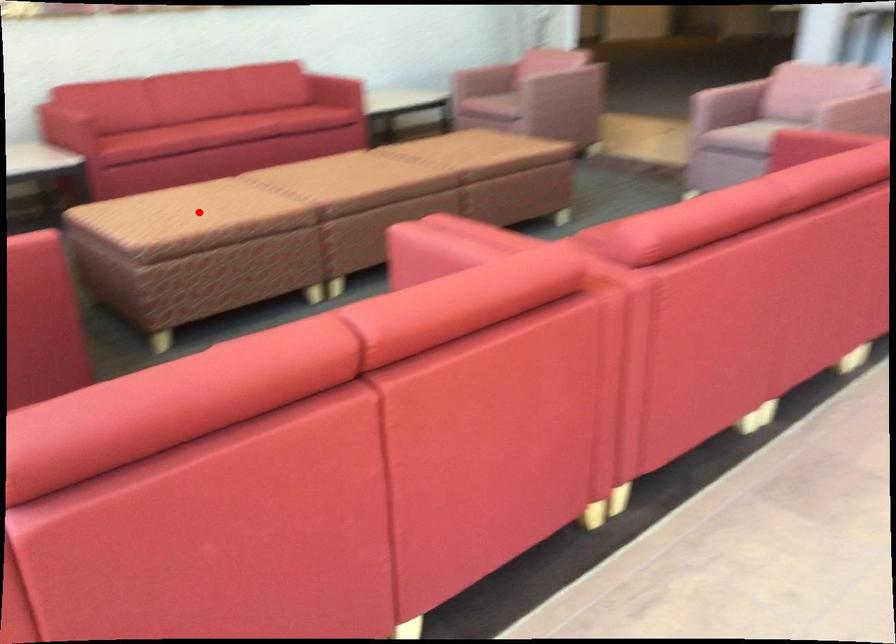
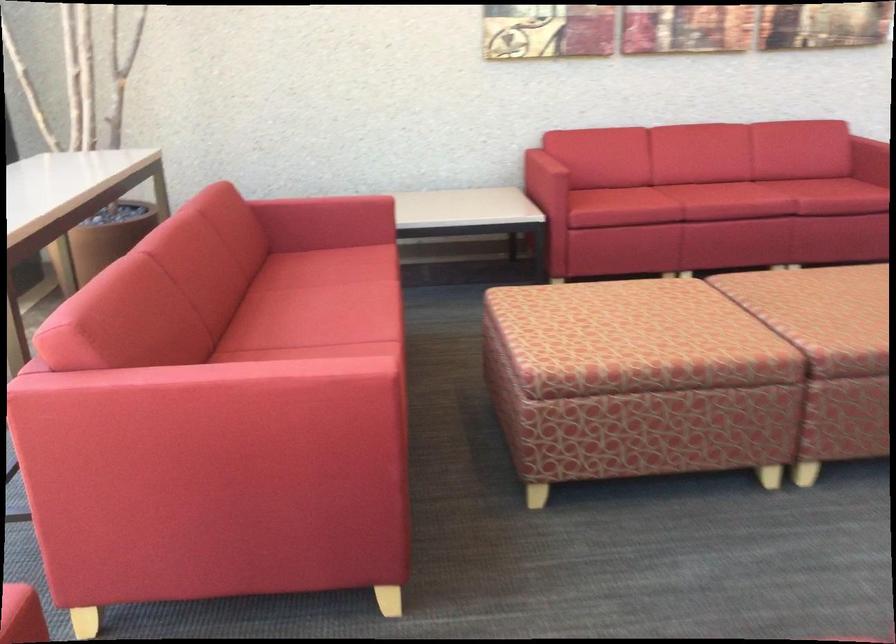
Question: I am providing you with two images of the same scene from different viewpoints. Image1 has a red point marked. In image2, the corresponding 3D location appears at what relative position? Reply with the corresponding letter.

Choices:
 (A) Closer
 (B) Farther

Answer: (A)